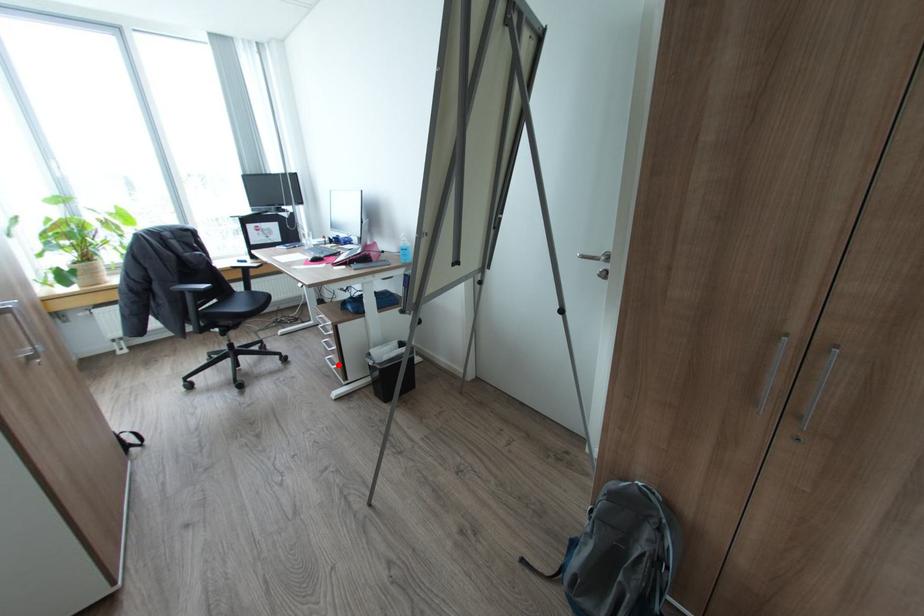
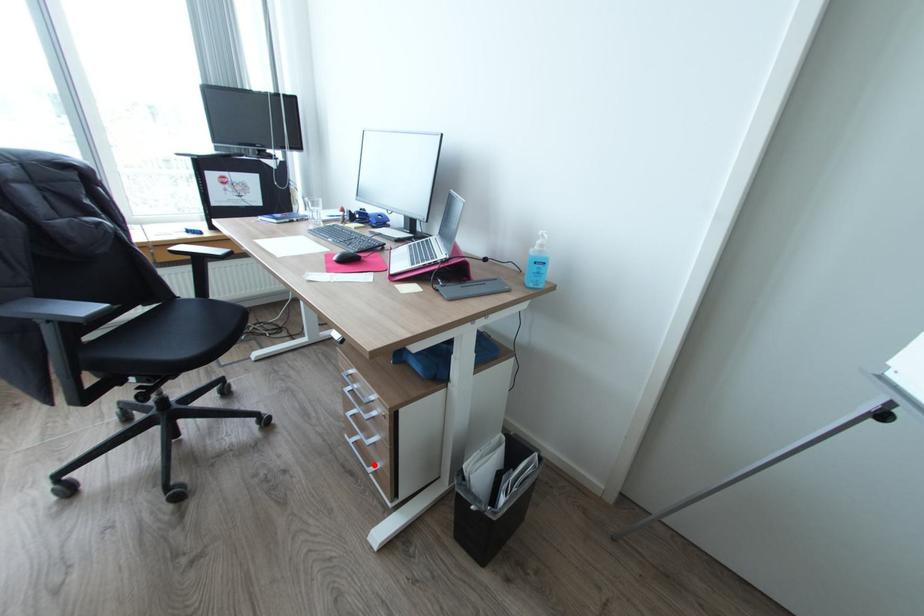
I am providing you with two images of the same scene from different viewpoints. A red point is marked on the first image and another point is marked on the second image. Are the points marked in image1 and image2 representing the same 3D position?

Yes